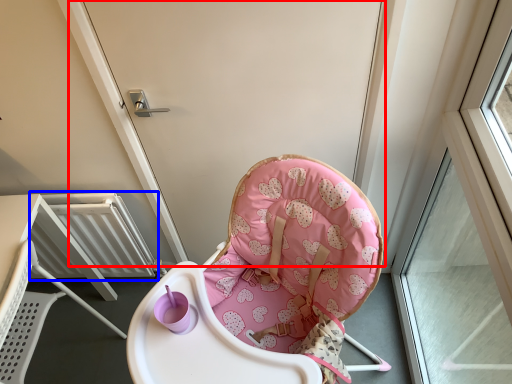
Question: Which point is closer to the camera, screen door (highlighted by a red box) or radiator (highlighted by a blue box)?

Choices:
 (A) screen door
 (B) radiator

Answer: (A)